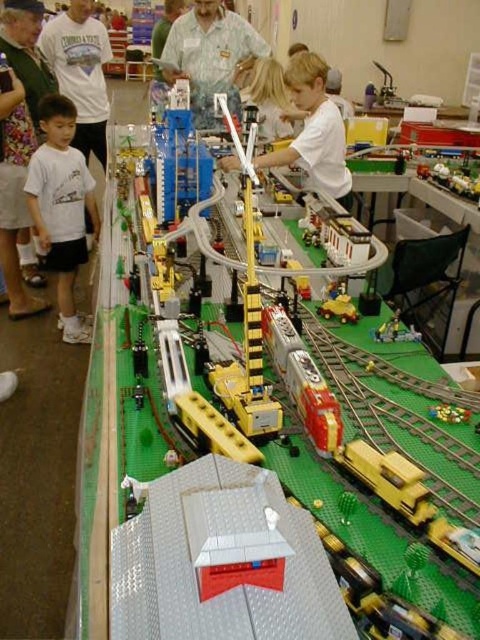
Question: Where is white matte shirt at left located in relation to white matte boy at center in the image?

Choices:
 (A) right
 (B) left

Answer: (B)

Question: Among these points, which one is nearest to the camera?

Choices:
 (A) [x=46, y=218]
 (B) [x=248, y=22]
 (C) [x=334, y=104]
 (D) [x=24, y=220]

Answer: (C)

Question: Can you confirm if light blue shirt at center is bigger than metallic yellow train at center?

Choices:
 (A) yes
 (B) no

Answer: (A)

Question: Which point is farther to the camera?

Choices:
 (A) (10, 131)
 (B) (395, 336)

Answer: (A)

Question: Does white matte boy at center appear on the right side of yellow plastic train at center?

Choices:
 (A) yes
 (B) no

Answer: (B)

Question: Which object is positioned farthest from the metallic yellow train at center?

Choices:
 (A) white matte shirt at left
 (B) white matte boy at center
 (C) yellow plastic train at center

Answer: (A)